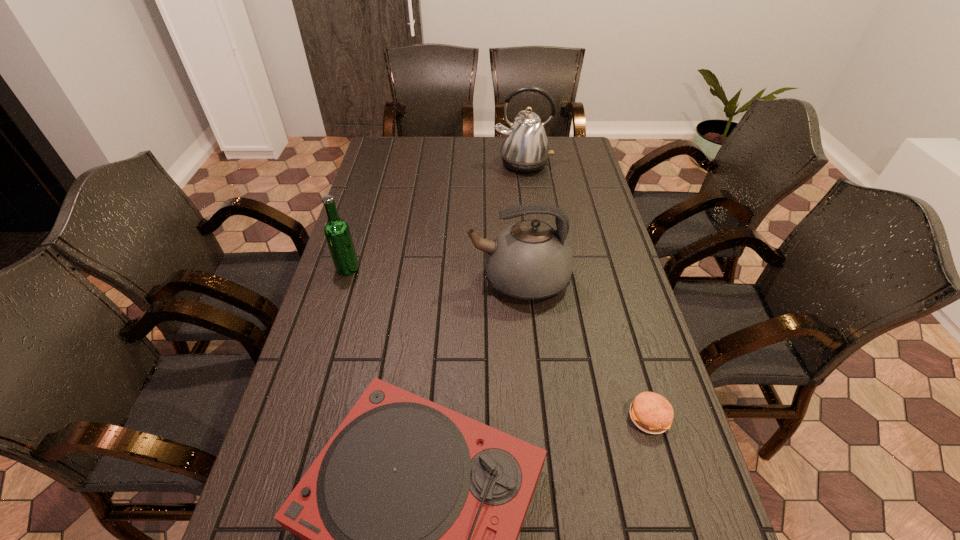
Identify the location of vacant space that satisfies the following two spatial constraints: 1. from the spout of the shortest object; 2. on the right side of the farthest object. (556, 417).

At what (x,y) coordinates should I click in order to perform the action: click on vacant space that satisfies the following two spatial constraints: 1. from the spout of the farther kettle; 2. at the spout of the shorter kettle. Please return your answer as a coordinate pair (x, y). Looking at the image, I should click on (538, 280).